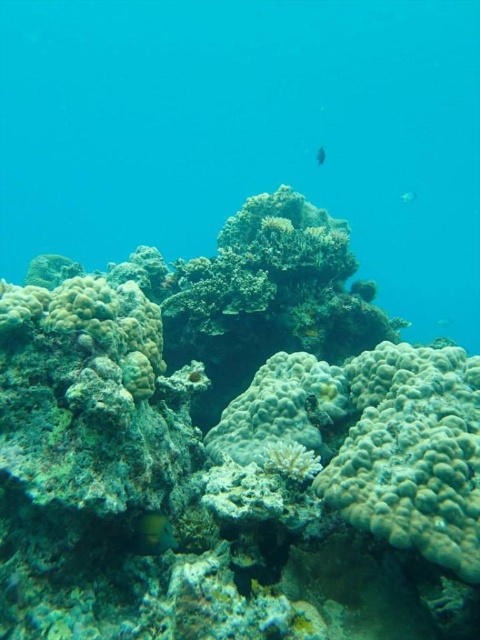
Does shiny yellow fish at lower left appear under translucent blue fish at upper center?

Yes, shiny yellow fish at lower left is below translucent blue fish at upper center.

Who is taller, shiny yellow fish at lower left or translucent blue fish at upper center?

translucent blue fish at upper center

Who is more forward, (155, 548) or (412, 189)?

Point (155, 548) is more forward.

Locate an element on the screen. Image resolution: width=480 pixels, height=640 pixels. shiny yellow fish at lower left is located at coordinates (152, 532).

Between point (162, 528) and point (317, 160), which one is positioned behind?

Point (317, 160)

Which is above, shiny yellow fish at lower left or shiny blue fish at center?

shiny blue fish at center is above.

At what (x,y) coordinates should I click in order to perform the action: click on shiny yellow fish at lower left. Please return your answer as a coordinate pair (x, y). Looking at the image, I should click on (152, 532).

Does point (415, 196) come closer to viewer compared to point (320, 160)?

No, (415, 196) is further to viewer.

Measure the distance between translucent blue fish at upper center and camera.

translucent blue fish at upper center is 8.38 meters away from camera.

Between point (407, 202) and point (316, 154), which one is positioned behind?

The point (407, 202) is behind.

Find the location of a particular element. The width and height of the screenshot is (480, 640). translucent blue fish at upper center is located at coordinates (408, 196).